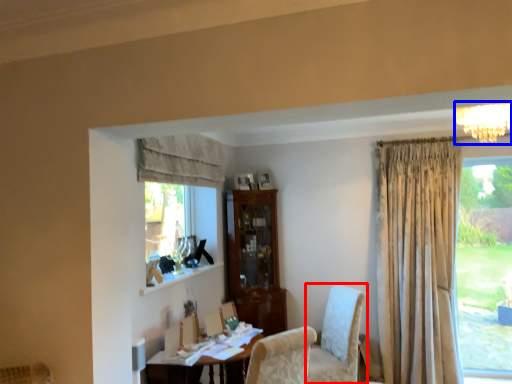
Question: Which object is further to the camera taking this photo, chair (highlighted by a red box) or light fixture (highlighted by a blue box)?

Choices:
 (A) chair
 (B) light fixture

Answer: (A)